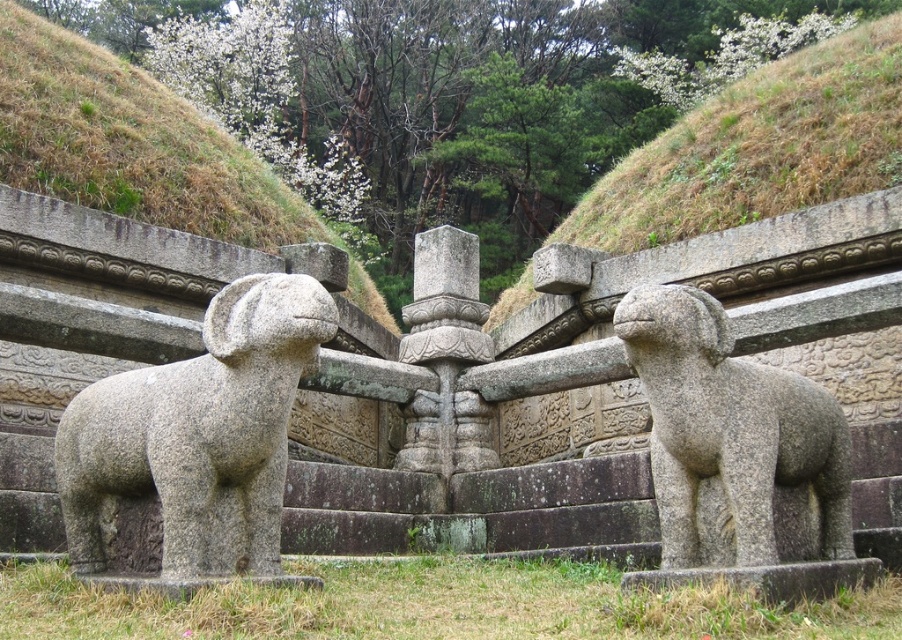
Question: Can you confirm if gray stone dog at left is positioned to the right of green grassy hillside at upper center?

Choices:
 (A) no
 (B) yes

Answer: (A)

Question: Which point is closer to the camera?

Choices:
 (A) (682, 380)
 (B) (885, 129)
 (C) (209, 369)

Answer: (A)

Question: Which is farther from the gray stone dog at left?

Choices:
 (A) gray stone dog at right
 (B) green grassy hillside at upper center

Answer: (B)

Question: Can you confirm if gray stone dog at left is positioned to the left of green grassy hillside at upper center?

Choices:
 (A) no
 (B) yes

Answer: (B)

Question: Which object appears farthest from the camera in this image?

Choices:
 (A) gray stone dog at right
 (B) gray stone dog at left

Answer: (A)

Question: Does green grassy hillside at upper center appear under gray stone dog at right?

Choices:
 (A) yes
 (B) no

Answer: (B)